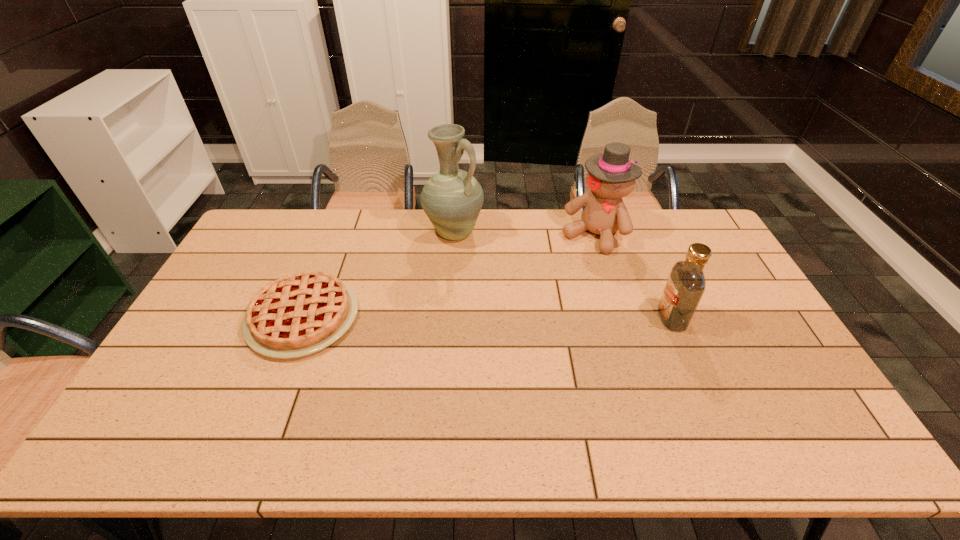
Where is `object positioned at the left edge`? The height and width of the screenshot is (540, 960). object positioned at the left edge is located at coordinates 302,313.

Find the location of a particular element. vacant space at the far edge is located at coordinates (308, 215).

In the image, there is a desktop. Identify the location of vacant space at the near edge. (254, 402).

At what (x,y) coordinates should I click in order to perform the action: click on free region at the left edge. Please return your answer as a coordinate pair (x, y). The image size is (960, 540). Looking at the image, I should click on (208, 301).

Identify the location of vacant space at the right edge of the desktop. (714, 254).

Where is `blank space at the far left corner`? blank space at the far left corner is located at coordinates (251, 235).

You are a GUI agent. You are given a task and a screenshot of the screen. Output one action in this format:
    pyautogui.click(x=<x>, y=<y>)
    Task: Click on the vacant space at the far right corner of the desktop
    The image size is (960, 540).
    Given the screenshot: What is the action you would take?
    pyautogui.click(x=715, y=248)

This screenshot has width=960, height=540. What are the coordinates of `free space between the leftmost object and the pitcher` in the screenshot? It's located at (378, 275).

You are a GUI agent. You are given a task and a screenshot of the screen. Output one action in this format:
    pyautogui.click(x=<x>, y=<y>)
    Task: Click on the vacant space that's between the rag_doll and the pitcher
    
    Given the screenshot: What is the action you would take?
    pyautogui.click(x=524, y=234)

At what (x,y) coordinates should I click in order to perform the action: click on free area in between the second object from right to left and the rightmost object. Please return your answer as a coordinate pair (x, y). Looking at the image, I should click on (633, 276).